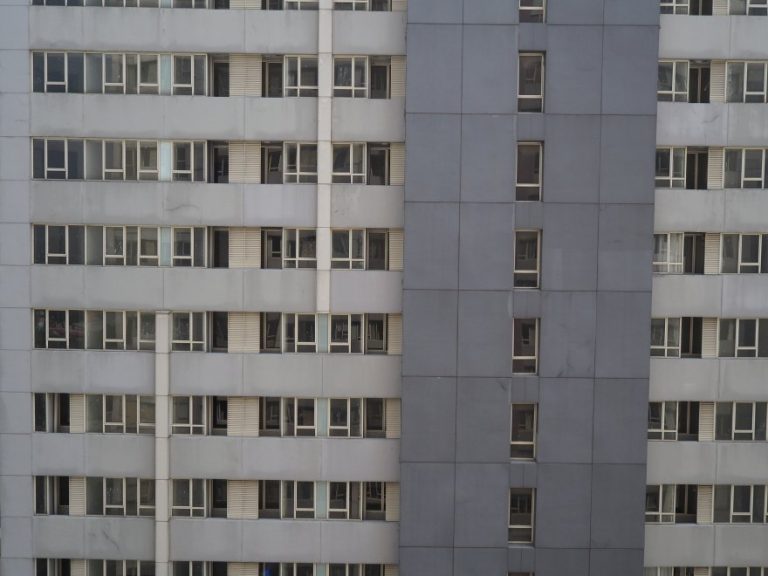
The height and width of the screenshot is (576, 768). I want to click on window, so click(114, 325).